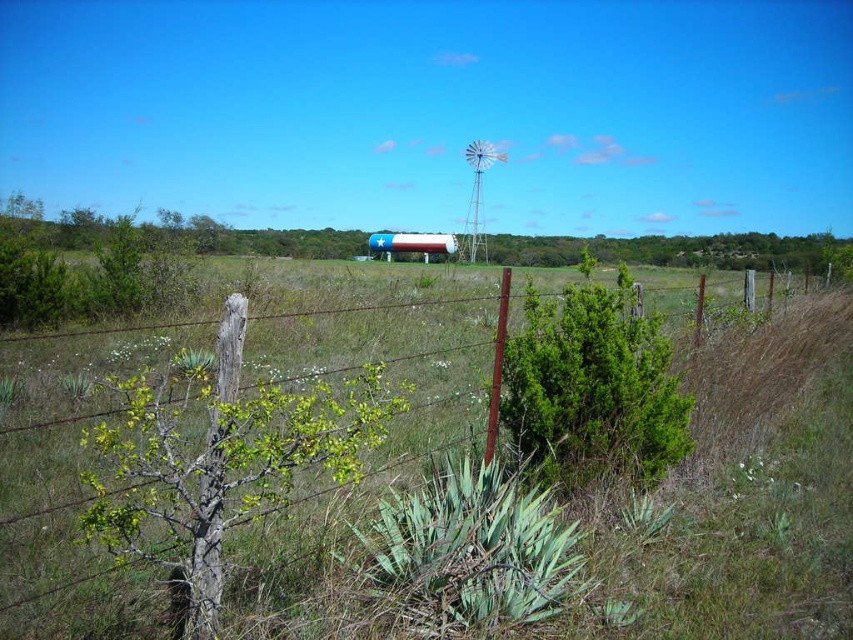
Question: Which of the following is the farthest from the observer?

Choices:
 (A) (486, 154)
 (B) (584, 465)

Answer: (A)

Question: Which object is closer to the camera taking this photo?

Choices:
 (A) white painted metal water tower at center
 (B) green leafy bush at center
 (C) green grass at center
 (D) green rough bark tree at center-left

Answer: (D)

Question: Does green grass at center appear under white painted metal water tower at center?

Choices:
 (A) no
 (B) yes

Answer: (B)

Question: Is green rough bark tree at center-left behind green leafy bush at center?

Choices:
 (A) no
 (B) yes

Answer: (A)

Question: Which point appears closest to the camera in this image?

Choices:
 (A) coord(532,426)
 (B) coord(128,614)

Answer: (B)

Question: Can you confirm if green grass at center is thinner than white painted metal water tower at center?

Choices:
 (A) yes
 (B) no

Answer: (B)